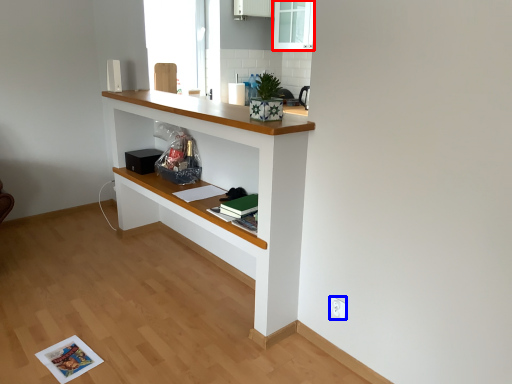
Question: Which object is further to the camera taking this photo, glass door (highlighted by a red box) or electric outlet (highlighted by a blue box)?

Choices:
 (A) glass door
 (B) electric outlet

Answer: (A)